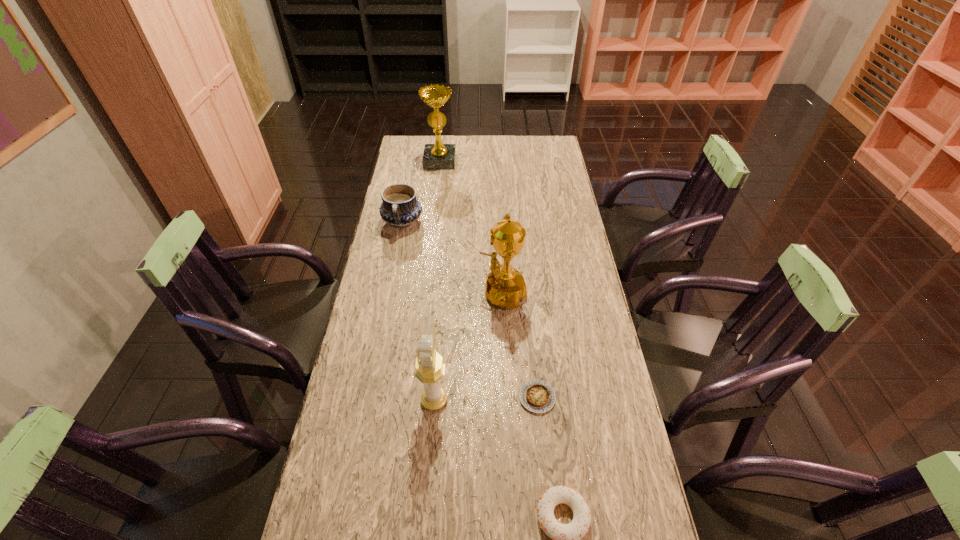
Image resolution: width=960 pixels, height=540 pixels. What are the coordinates of `free space between the farthest object and the nearest award` in the screenshot? It's located at (437, 280).

Locate an element on the screen. The image size is (960, 540). free spot between the nearest award and the quiche is located at coordinates (486, 399).

Identify the location of object that can be found as the fourth closest to the second shortest object. This screenshot has width=960, height=540. (400, 208).

At what (x,y) coordinates should I click in order to perform the action: click on object that is the closest one to the third shortest object. Please return your answer as a coordinate pair (x, y). Looking at the image, I should click on (505, 286).

Identify which award is the second closest to the nearest object. Please provide its 2D coordinates. Your answer should be formatted as a tuple, i.e. [(x, y)], where the tuple contains the x and y coordinates of a point satisfying the conditions above.

[(505, 286)]

This screenshot has width=960, height=540. Identify the location of award that is the second closest one to the farthest award. (x=429, y=369).

The image size is (960, 540). Identify the location of blank space that satisfies the following two spatial constraints: 1. on the front side of the rightmost award; 2. on the left side of the shortest object. (501, 397).

You are a GUI agent. You are given a task and a screenshot of the screen. Output one action in this format:
    pyautogui.click(x=<x>, y=<y>)
    Task: Click on the vacant space that satisfies the following two spatial constraints: 1. on the front-facing side of the shortest object; 2. on the right side of the farthest award
    Image resolution: width=960 pixels, height=540 pixels.
    Given the screenshot: What is the action you would take?
    click(x=412, y=397)

You are a GUI agent. You are given a task and a screenshot of the screen. Output one action in this format:
    pyautogui.click(x=<x>, y=<y>)
    Task: Click on the blank space that satisfies the following two spatial constraints: 1. on the front side of the shortest object; 2. on the left side of the third shortest object
    
    Given the screenshot: What is the action you would take?
    pyautogui.click(x=369, y=397)